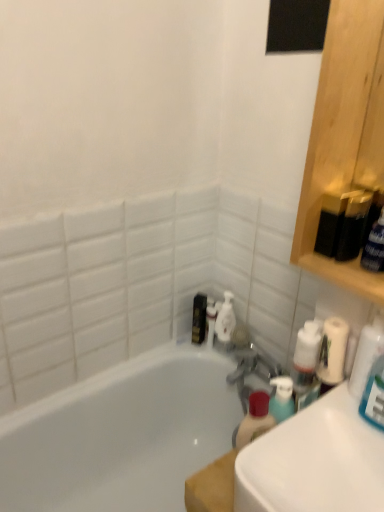
You are a GUI agent. You are given a task and a screenshot of the screen. Output one action in this format:
    pyautogui.click(x=<x>, y=<y>)
    Task: Click on the space that is in front of white plastic soap dispenser at lower center, the first toiletry positioned from the right
    
    Given the screenshot: What is the action you would take?
    pyautogui.click(x=229, y=359)